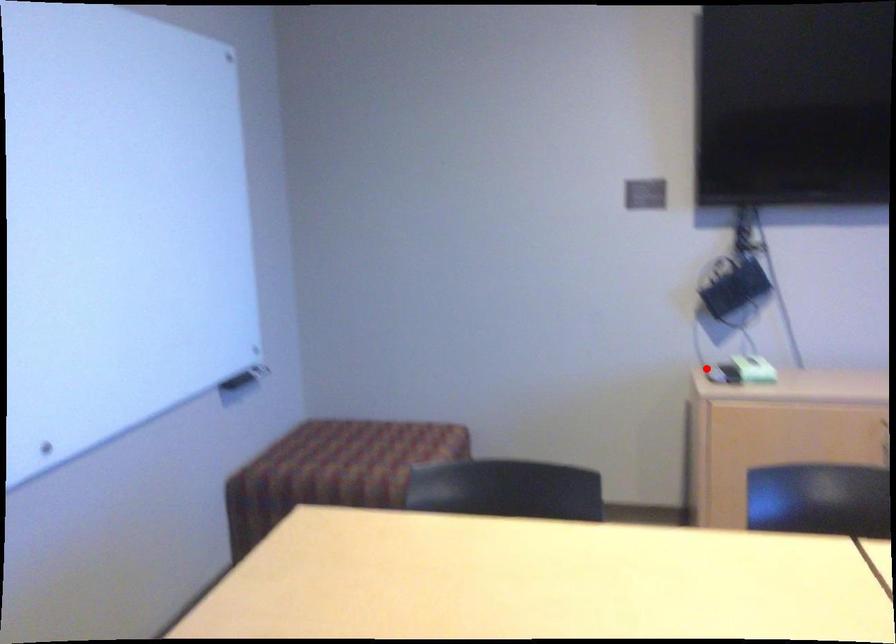
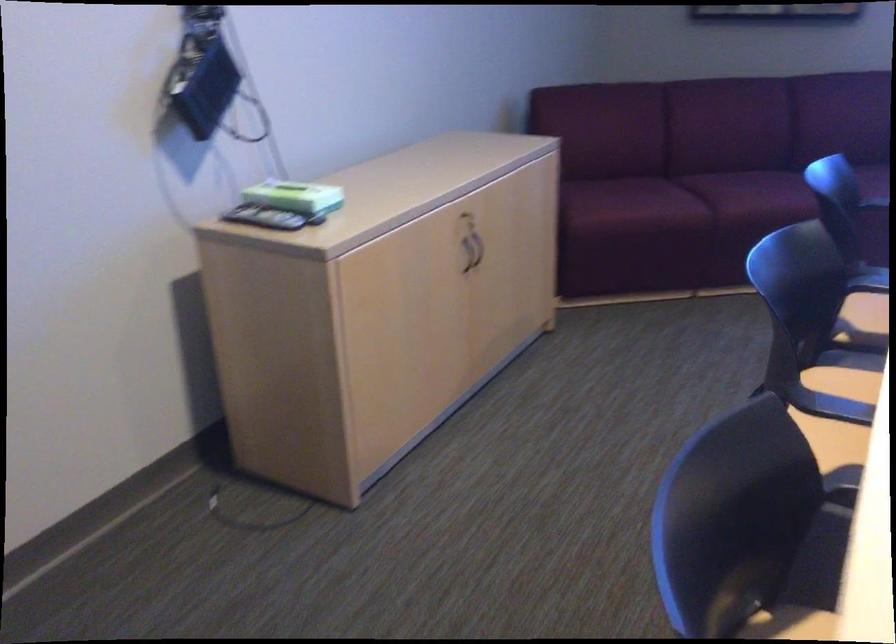
Question: I am providing you with two images of the same scene from different viewpoints. A red point is shown in image1. For the corresponding object point in image2, is it positioned nearer or farther from the camera?

Choices:
 (A) Nearer
 (B) Farther

Answer: (A)